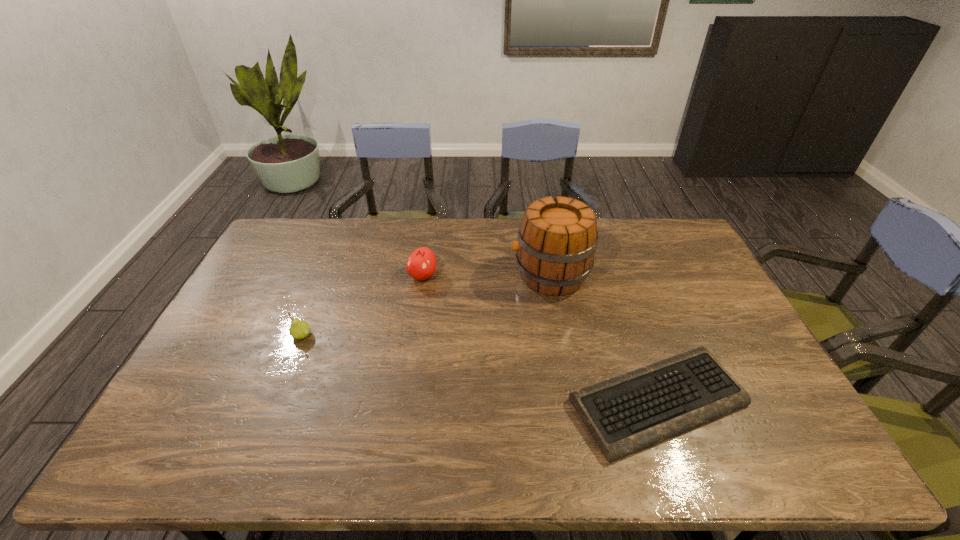
In the image, there is a desktop. Where is `vacant space at the near left corner`? Image resolution: width=960 pixels, height=540 pixels. vacant space at the near left corner is located at coordinates (150, 461).

In the image, there is a desktop. Where is `free space at the far right corner`? free space at the far right corner is located at coordinates (655, 222).

At what (x,y) coordinates should I click in order to perform the action: click on vacant space that's between the second tallest object and the cider. Please return your answer as a coordinate pair (x, y). Looking at the image, I should click on (487, 275).

At what (x,y) coordinates should I click in order to perform the action: click on free space between the computer keyboard and the second nearest object. Please return your answer as a coordinate pair (x, y). This screenshot has height=540, width=960. Looking at the image, I should click on (480, 369).

Identify the location of vacant space that is in between the third object from right to left and the shortest object. (540, 339).

This screenshot has height=540, width=960. I want to click on empty space that is in between the nearest object and the second object from left to right, so pos(540,339).

You are a GUI agent. You are given a task and a screenshot of the screen. Output one action in this format:
    pyautogui.click(x=<x>, y=<y>)
    Task: Click on the blank region between the nearest object and the cider
    
    Given the screenshot: What is the action you would take?
    pyautogui.click(x=604, y=339)

This screenshot has width=960, height=540. What are the coordinates of `vacant area that lies between the second nearest object and the apple` in the screenshot? It's located at (362, 306).

The height and width of the screenshot is (540, 960). What are the coordinates of `empty location between the tallest object and the second tallest object` in the screenshot? It's located at (487, 275).

Image resolution: width=960 pixels, height=540 pixels. I want to click on blank region between the cider and the apple, so click(x=487, y=275).